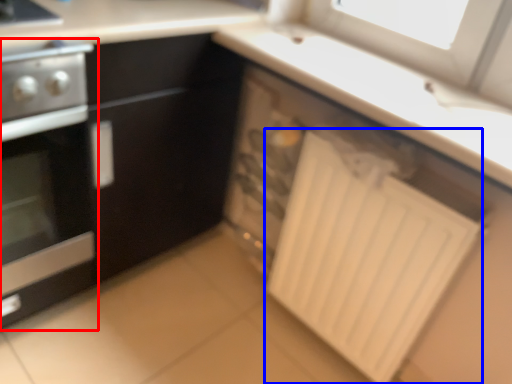
Question: Which object appears closest to the camera in this image, home appliance (highlighted by a red box) or radiator (highlighted by a blue box)?

Choices:
 (A) home appliance
 (B) radiator

Answer: (A)